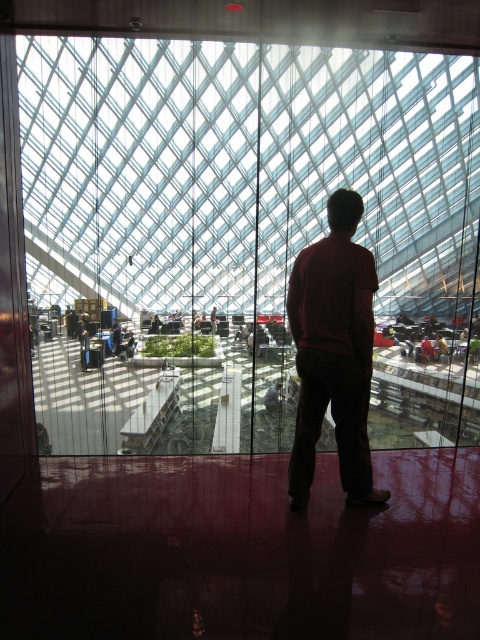
Question: Which point is farther to the camera?

Choices:
 (A) (360, 310)
 (B) (328, 180)

Answer: (B)

Question: Does transparent glass window at center appear on the right side of dark red sweater at center?

Choices:
 (A) yes
 (B) no

Answer: (B)

Question: Which object appears closest to the camera in this image?

Choices:
 (A) transparent glass window at center
 (B) dark red sweater at center

Answer: (B)

Question: Can you confirm if transparent glass window at center is smaller than dark red sweater at center?

Choices:
 (A) no
 (B) yes

Answer: (A)

Question: Does transparent glass window at center have a smaller size compared to dark red sweater at center?

Choices:
 (A) no
 (B) yes

Answer: (A)

Question: Among these objects, which one is farthest from the camera?

Choices:
 (A) transparent glass window at center
 (B) dark red sweater at center

Answer: (A)